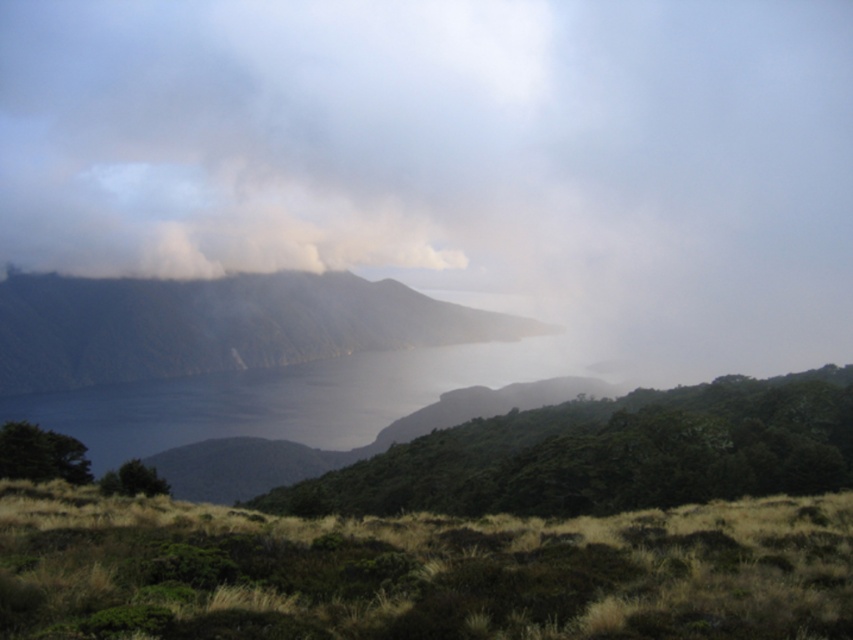
Question: Considering the real-world distances, which object is closest to the dark gray rocky mountain at center?

Choices:
 (A) white foggy cloud at upper center
 (B) green matte grass at lower center

Answer: (A)

Question: Which is farther from the green matte grass at lower center?

Choices:
 (A) white foggy cloud at upper center
 (B) dark gray rocky mountain at center

Answer: (A)

Question: In this image, where is green matte grass at lower center located relative to dark gray rocky mountain at center?

Choices:
 (A) left
 (B) right

Answer: (B)

Question: Can you confirm if white foggy cloud at upper center is wider than green matte grass at lower center?

Choices:
 (A) no
 (B) yes

Answer: (B)

Question: Can you confirm if white foggy cloud at upper center is positioned to the left of green matte grass at lower center?

Choices:
 (A) no
 (B) yes

Answer: (B)

Question: Which point is farther to the camera?

Choices:
 (A) (737, 513)
 (B) (378, 234)
 (C) (242, 328)

Answer: (B)